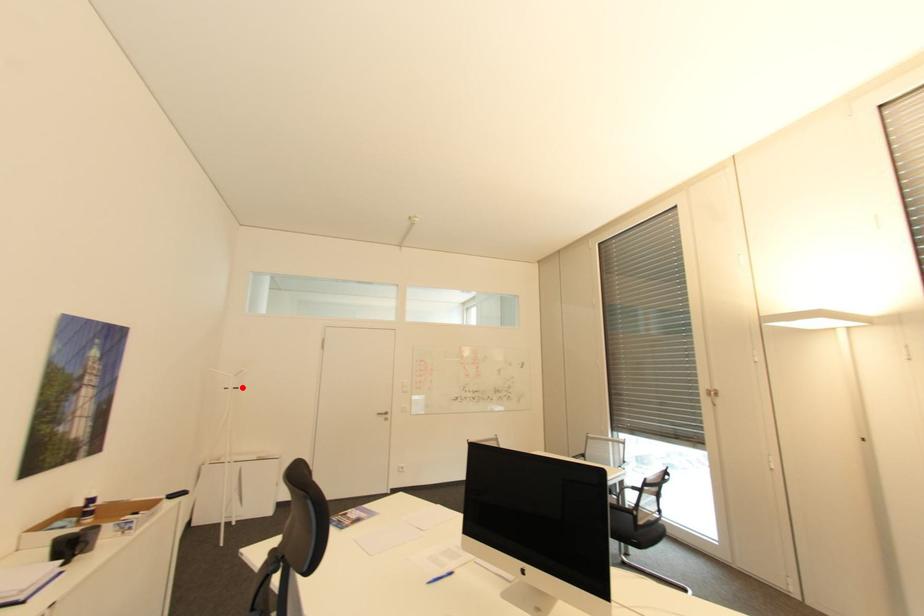
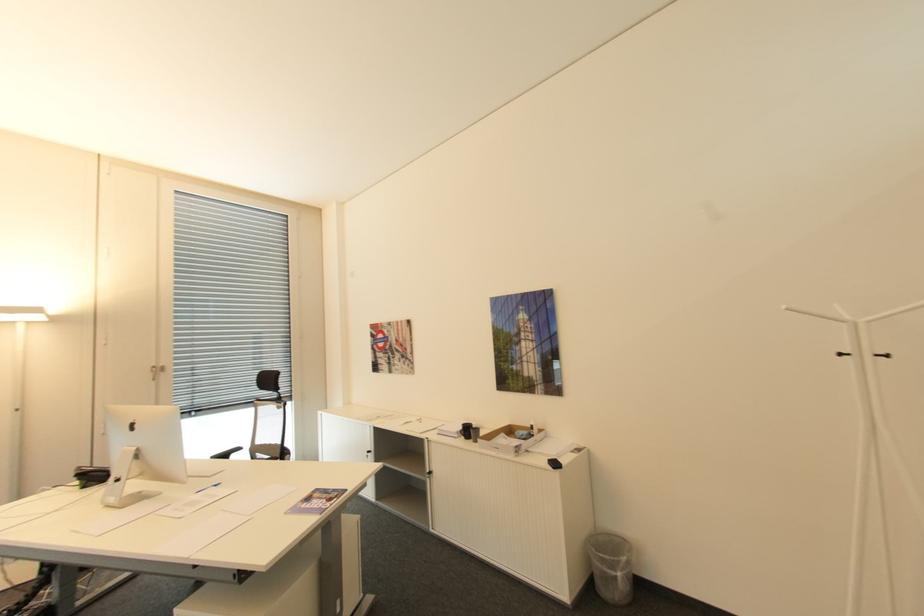
Question: A red point is marked in image1. In image2, is the corresponding 3D point closer to the camera or farther? Reply with the corresponding letter.

Choices:
 (A) The corresponding 3D point is closer.
 (B) The corresponding 3D point is farther.

Answer: (A)